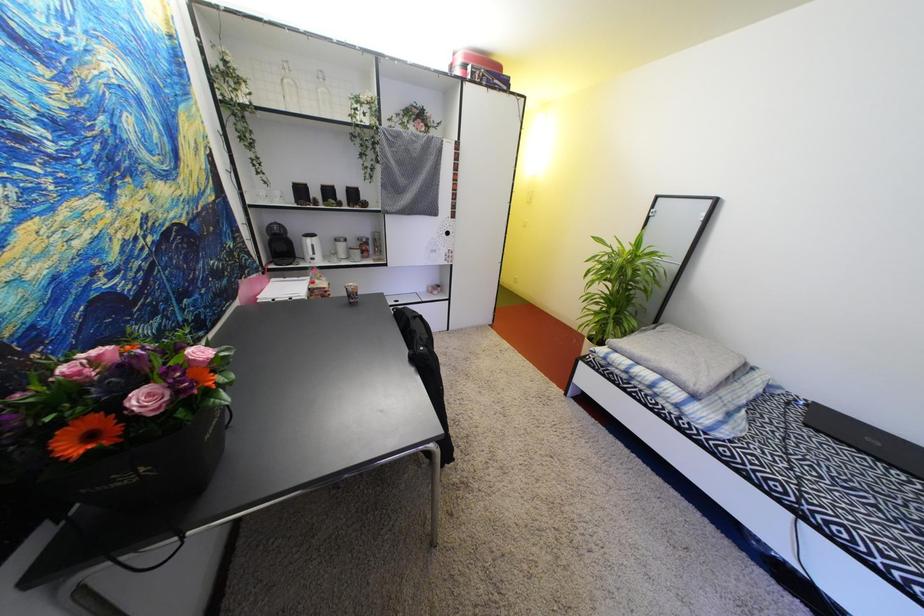
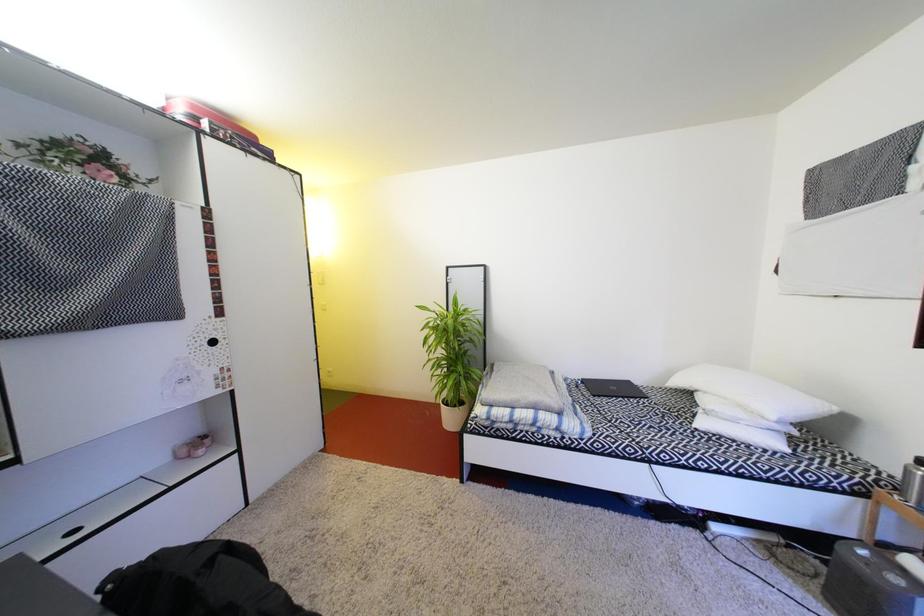
Question: The camera is either moving clockwise (left) or counter-clockwise (right) around the object. The first image is from the beginning of the video and the second image is from the end. Is the camera moving left or right when shooting the video?

Choices:
 (A) Left
 (B) Right

Answer: (A)